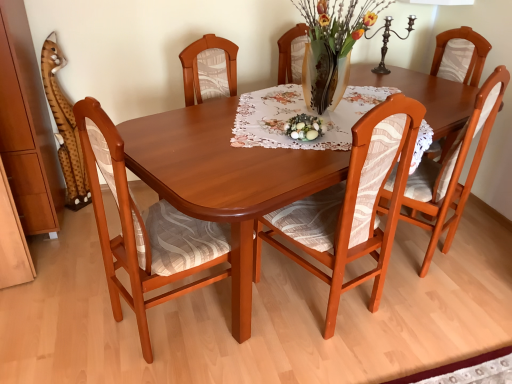
Describe the element at coordinates (351, 205) in the screenshot. The image size is (512, 384). I see `matte wood chair at center, the 2th chair from the right` at that location.

This screenshot has height=384, width=512. Identify the location of matte wood chair at center, arranged as the first chair when viewed from the right. point(453,171).

What do you see at coordinates (144, 228) in the screenshot? The height and width of the screenshot is (384, 512). I see `wooden chair at left, which is the 3th chair from right to left` at bounding box center [144, 228].

Measure the distance between point (306, 135) and camera.

The distance of point (306, 135) from camera is 5.34 feet.

This screenshot has height=384, width=512. Describe the element at coordinates (224, 179) in the screenshot. I see `shiny wood table at center` at that location.

The height and width of the screenshot is (384, 512). What are the coordinates of `matte wood chair at center, the 2th chair from the right` in the screenshot? It's located at (351, 205).

How many degrees apart are the facing directions of matte green glass bowl at center and wooden chair at left, which is the 3th chair from right to left?

The angular difference between matte green glass bowl at center and wooden chair at left, which is the 3th chair from right to left, is 134 degrees.

Consider the image. Which is closer to the camera, (323, 126) or (166, 224)?

The point (323, 126) is closer to the camera.

Between matte green glass bowl at center and wooden chair at left, which is the 3th chair from right to left, which one is positioned behind?

Positioned behind is matte green glass bowl at center.

In order to click on chair that is the 3rd object located below the matte green glass bowl at center (from the image's perspective) in this screenshot , I will do `click(144, 228)`.

Is matte wood chair at center, arranged as the first chair when viewed from the right, thinner than matte wood chair at center, the 2th chair from the right?

No, matte wood chair at center, arranged as the first chair when viewed from the right, is not thinner than matte wood chair at center, the 2th chair from the right.

Consider the image. From a real-world perspective, is matte wood chair at center, arranged as the first chair when viewed from the right, physically located above or below matte wood chair at center, the 2th chair from the right?

matte wood chair at center, arranged as the first chair when viewed from the right, is above matte wood chair at center, the 2th chair from the right.

What's the angular difference between matte wood chair at center, arranged as the first chair when viewed from the right, and matte wood chair at center, positioned as the 2th chair in left-to-right order,'s facing directions?

12 degrees separate the facing orientations of matte wood chair at center, arranged as the first chair when viewed from the right, and matte wood chair at center, positioned as the 2th chair in left-to-right order.

Is matte wood chair at center, arranged as the first chair when viewed from the right, not within matte wood chair at center, positioned as the 2th chair in left-to-right order?

Absolutely, matte wood chair at center, arranged as the first chair when viewed from the right, is external to matte wood chair at center, positioned as the 2th chair in left-to-right order.

Which object is thinner, shiny wood table at center or wooden chair at left, which is the 3th chair from right to left?

wooden chair at left, which is the 3th chair from right to left.

The image size is (512, 384). Identify the location of kitchen & dining room table located in front of the wooden chair at left, marked as the first chair in a left-to-right arrangement. (224, 179).

Considering the sizes of objects shiny wood table at center and wooden chair at left, which is the 3th chair from right to left, in the image provided, who is shorter, shiny wood table at center or wooden chair at left, which is the 3th chair from right to left,?

Standing shorter between the two is shiny wood table at center.

From the image's perspective, is shiny wood table at center over wooden chair at left, which is the 3th chair from right to left?

No, from the image's perspective, shiny wood table at center is not on top of wooden chair at left, which is the 3th chair from right to left.

Is shiny wood table at center facing away from matte wood chair at center, the 2th chair from the right?

That's not correct — shiny wood table at center is not looking away from matte wood chair at center, the 2th chair from the right.

Is shiny wood table at center bigger or smaller than matte wood chair at center, the 2th chair from the right?

In the image, shiny wood table at center appears to be larger than matte wood chair at center, the 2th chair from the right.

Between point (258, 182) and point (314, 218), which one is positioned in front?

The point (258, 182) is more forward.

How distant is matte wood chair at center, the 2th chair from the right, from wooden chair at left, which is the 3th chair from right to left?

matte wood chair at center, the 2th chair from the right, is 19.96 inches from wooden chair at left, which is the 3th chair from right to left.

Between matte wood chair at center, positioned as the 2th chair in left-to-right order, and wooden chair at left, marked as the first chair in a left-to-right arrangement, which one has more height?

With more height is matte wood chair at center, positioned as the 2th chair in left-to-right order.

Would you say matte wood chair at center, positioned as the 2th chair in left-to-right order, is outside wooden chair at left, which is the 3th chair from right to left?

Yes, matte wood chair at center, positioned as the 2th chair in left-to-right order, is located beyond the bounds of wooden chair at left, which is the 3th chair from right to left.

Is matte wood chair at center, the 2th chair from the right, wider or thinner than wooden chair at left, marked as the first chair in a left-to-right arrangement?

Considering their sizes, matte wood chair at center, the 2th chair from the right, looks slimmer than wooden chair at left, marked as the first chair in a left-to-right arrangement.

Considering the sizes of matte green glass bowl at center and matte wood chair at center, positioned as the 2th chair in left-to-right order, in the image, is matte green glass bowl at center taller or shorter than matte wood chair at center, positioned as the 2th chair in left-to-right order,?

Considering their sizes, matte green glass bowl at center has less height than matte wood chair at center, positioned as the 2th chair in left-to-right order.

Can you tell me how much matte green glass bowl at center and matte wood chair at center, positioned as the 2th chair in left-to-right order, differ in facing direction?

The angle between the facing direction of matte green glass bowl at center and the facing direction of matte wood chair at center, positioned as the 2th chair in left-to-right order, is 141 degrees.

From a real-world perspective, does matte green glass bowl at center stand above matte wood chair at center, positioned as the 2th chair in left-to-right order?

Correct, in the physical world, matte green glass bowl at center is higher than matte wood chair at center, positioned as the 2th chair in left-to-right order.

The height and width of the screenshot is (384, 512). Identify the location of the 2nd chair in front of the matte green glass bowl at center, starting your count from the anchor. (351, 205).

Identify the location of chair on the left of matte wood chair at center, the 2th chair from the right. Image resolution: width=512 pixels, height=384 pixels. (144, 228).

From the image's perspective, is wooden chair at left, marked as the first chair in a left-to-right arrangement, positioned above or below matte wood chair at center, the 2th chair from the right?

Clearly, from the image's perspective, wooden chair at left, marked as the first chair in a left-to-right arrangement, is below matte wood chair at center, the 2th chair from the right.

Who is more distant, wooden chair at left, marked as the first chair in a left-to-right arrangement, or matte wood chair at center, the 2th chair from the right?

matte wood chair at center, the 2th chair from the right, is further away from the camera.

Is wooden chair at left, which is the 3th chair from right to left, oriented towards matte wood chair at center, the 2th chair from the right?

Yes.

Where is `chair that is the 3rd one below the matte green glass bowl at center (from a real-world perspective)`? The width and height of the screenshot is (512, 384). chair that is the 3rd one below the matte green glass bowl at center (from a real-world perspective) is located at coordinates (144, 228).

The height and width of the screenshot is (384, 512). In order to click on the 1st chair in front when counting from the matte wood chair at center, acting as the third chair starting from the left in this screenshot , I will do 351,205.

From the image, which object appears to be farther from matte wood chair at center, arranged as the first chair when viewed from the right, matte wood chair at center, positioned as the 2th chair in left-to-right order, or matte green glass bowl at center?

matte green glass bowl at center.

Based on the photo, estimate the real-world distances between objects in this image. Which object is further from wooden chair at left, which is the 3th chair from right to left, matte wood chair at center, acting as the third chair starting from the left, or shiny wood table at center?

matte wood chair at center, acting as the third chair starting from the left, is further to wooden chair at left, which is the 3th chair from right to left.

Estimate the real-world distances between objects in this image. Which object is further from shiny wood table at center, matte wood chair at center, the 2th chair from the right, or matte wood chair at center, arranged as the first chair when viewed from the right?

matte wood chair at center, arranged as the first chair when viewed from the right, lies further to shiny wood table at center than the other object.

From the picture: Which object lies further to the anchor point shiny wood table at center, matte wood chair at center, arranged as the first chair when viewed from the right, or matte green glass bowl at center?

The object further to shiny wood table at center is matte wood chair at center, arranged as the first chair when viewed from the right.

Which object lies further to the anchor point shiny wood table at center, matte green glass bowl at center or wooden chair at left, marked as the first chair in a left-to-right arrangement?

matte green glass bowl at center lies further to shiny wood table at center than the other object.

Considering their positions, is matte green glass bowl at center positioned closer to matte wood chair at center, acting as the third chair starting from the left, than wooden chair at left, which is the 3th chair from right to left?

Based on the image, matte green glass bowl at center appears to be nearer to matte wood chair at center, acting as the third chair starting from the left.

Based on their spatial positions, is wooden chair at left, marked as the first chair in a left-to-right arrangement, or matte wood chair at center, positioned as the 2th chair in left-to-right order, closer to shiny wood table at center?

wooden chair at left, marked as the first chair in a left-to-right arrangement, is closer to shiny wood table at center.

Estimate the real-world distances between objects in this image. Which object is closer to shiny wood table at center, matte green glass bowl at center or matte wood chair at center, arranged as the first chair when viewed from the right?

matte green glass bowl at center lies closer to shiny wood table at center than the other object.

Identify the location of chair located between shiny wood table at center and matte wood chair at center, arranged as the first chair when viewed from the right, in the left-right direction. The height and width of the screenshot is (384, 512). (351, 205).

Find the location of a particular element. Image resolution: width=512 pixels, height=384 pixels. chair between wooden chair at left, which is the 3th chair from right to left, and matte wood chair at center, arranged as the first chair when viewed from the right is located at coordinates (351, 205).

Find the location of a particular element. tableware between shiny wood table at center and matte wood chair at center, acting as the third chair starting from the left is located at coordinates (304, 127).

Identify the location of kitchen & dining room table between wooden chair at left, marked as the first chair in a left-to-right arrangement, and matte wood chair at center, positioned as the 2th chair in left-to-right order. The height and width of the screenshot is (384, 512). (224, 179).